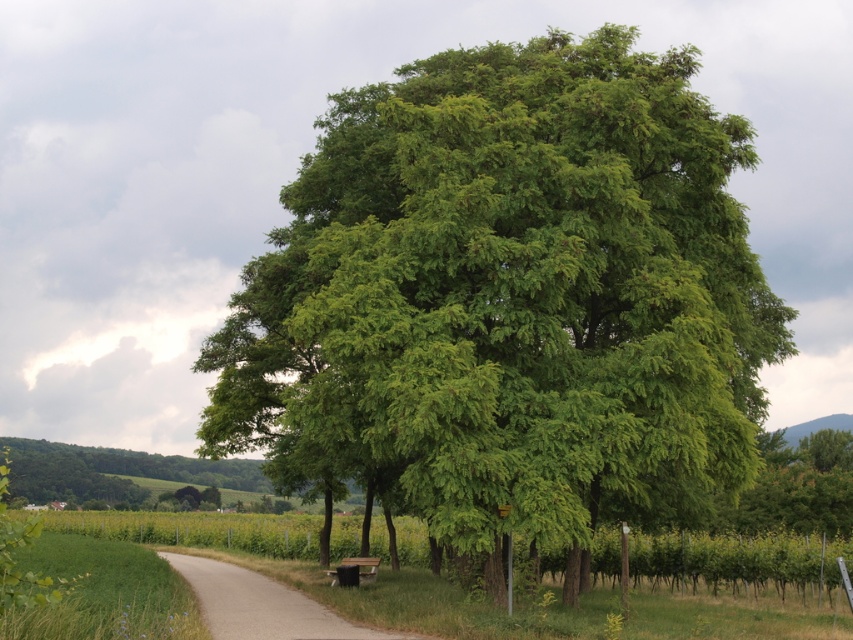
Who is shorter, green leafy tree at center or wooden park bench at lower center?

wooden park bench at lower center

Who is positioned more to the left, green leafy tree at center or wooden park bench at lower center?

wooden park bench at lower center

Who is more distant from viewer, (718, 282) or (335, 580)?

The point (335, 580) is behind.

I want to click on green leafy tree at center, so click(x=509, y=300).

Consider the image. Can you confirm if green leafy tree at center is positioned below gray concrete path at center?

No.

Is green leafy tree at center smaller than gray concrete path at center?

Actually, green leafy tree at center might be larger than gray concrete path at center.

Is point (721, 388) positioned after point (222, 577)?

No, (721, 388) is in front of (222, 577).

What are the coordinates of `green leafy tree at center` in the screenshot? It's located at (509, 300).

This screenshot has height=640, width=853. Describe the element at coordinates (263, 605) in the screenshot. I see `gray concrete path at center` at that location.

Which of these two, gray concrete path at center or wooden park bench at lower center, stands shorter?

Standing shorter between the two is wooden park bench at lower center.

This screenshot has width=853, height=640. Describe the element at coordinates (263, 605) in the screenshot. I see `gray concrete path at center` at that location.

Locate an element on the screen. The height and width of the screenshot is (640, 853). gray concrete path at center is located at coordinates (263, 605).